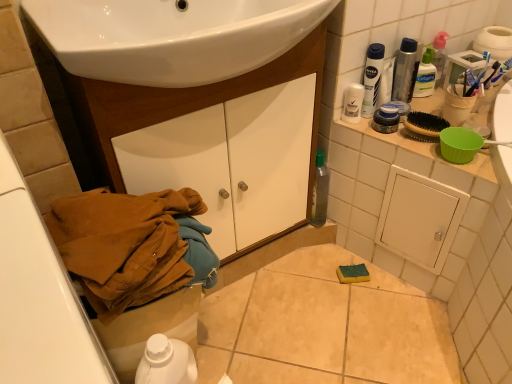
The height and width of the screenshot is (384, 512). I want to click on vacant space in front of clear plastic bottle at upper right, which ranks as the 1th toiletry in back-to-front order, so click(447, 114).